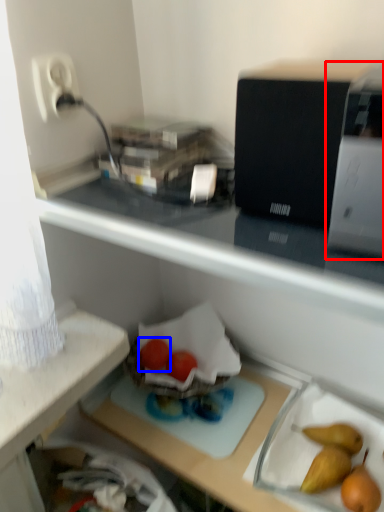
Question: Which of the following is the closest to the observer, appliance (highlighted by a red box) or green vegetables (highlighted by a blue box)?

Choices:
 (A) appliance
 (B) green vegetables

Answer: (A)